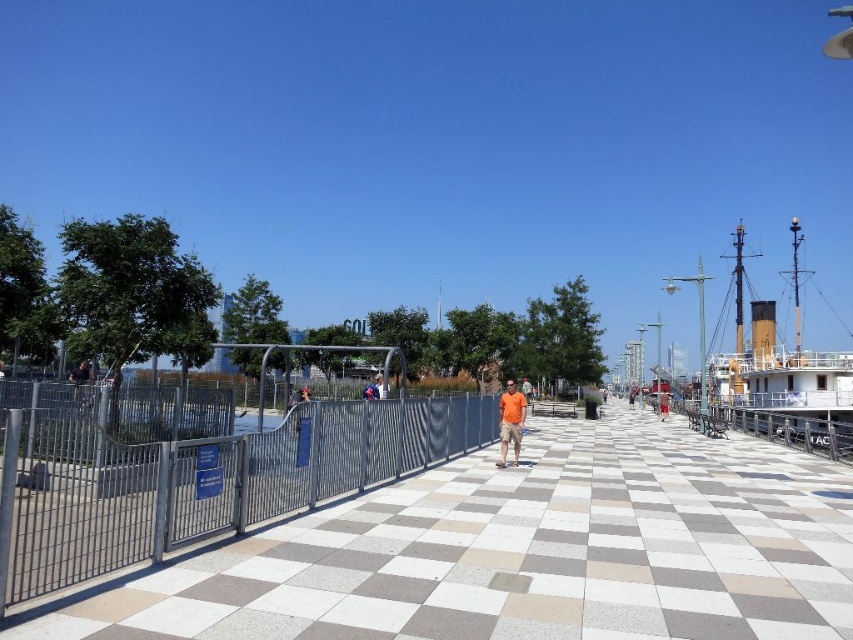
You are standing at the waterfront promenade and want to find the white checkered pavement at center. According to the coordinates provided, where exactly should you look?

The white checkered pavement at center is located at coordinates point [527,552].